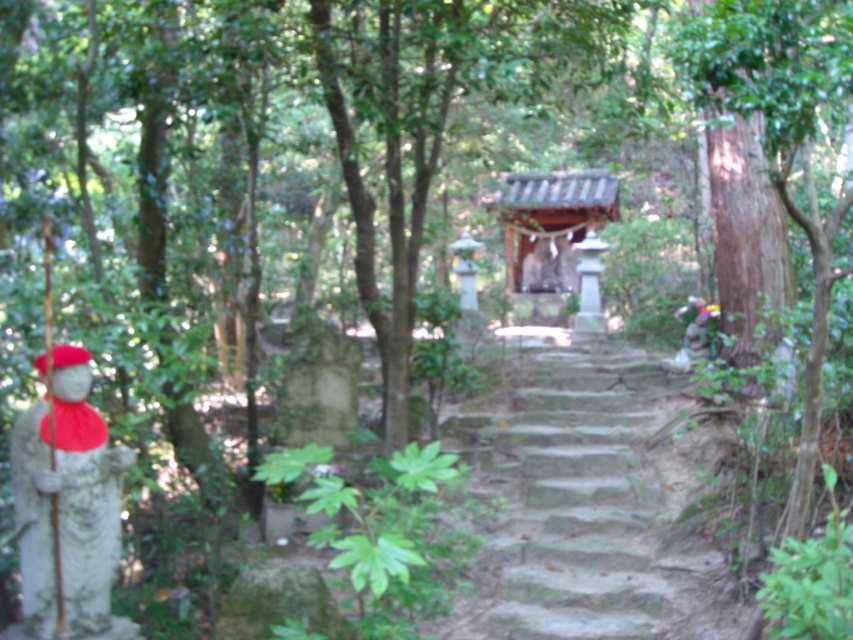
Is stone steps at center to the left of smooth stone statue at left from the viewer's perspective?

Incorrect, stone steps at center is not on the left side of smooth stone statue at left.

Is point (688, 624) in front of point (47, 620)?

No, (688, 624) is further to viewer.

At what (x,y) coordinates should I click in order to perform the action: click on stone steps at center. Please return your answer as a coordinate pair (x, y). Image resolution: width=853 pixels, height=640 pixels. Looking at the image, I should click on (579, 506).